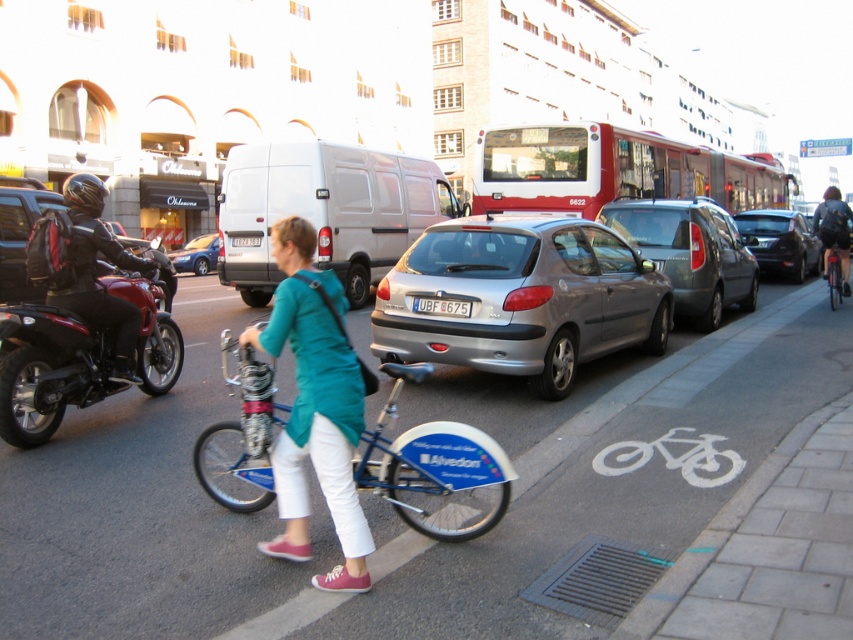
You are a photographer standing at the camera position. You want to take a photo that includes both the point at coordinates (724, 204) and the point at (836, 275). Which point will appear closer to the bottom edge of the photo?

Point (836, 275) will appear closer to the bottom edge of the photo because it is closer to the camera than point (724, 204).

You are a delivery person who needs to quickly reach the address on the other side of the street. You see the red matte bus at upper right and the metallic blue bicycle at right. Which object is closer to you, and can you use it to cross the street safely?

The metallic blue bicycle at right is behind the red matte bus at upper right, so the red matte bus at upper right is closer to you. However, since the bus is parked or moving, using the bicycle might not be safe unless it belongs to you. The safest option would be to wait for a traffic light or crosswalk.